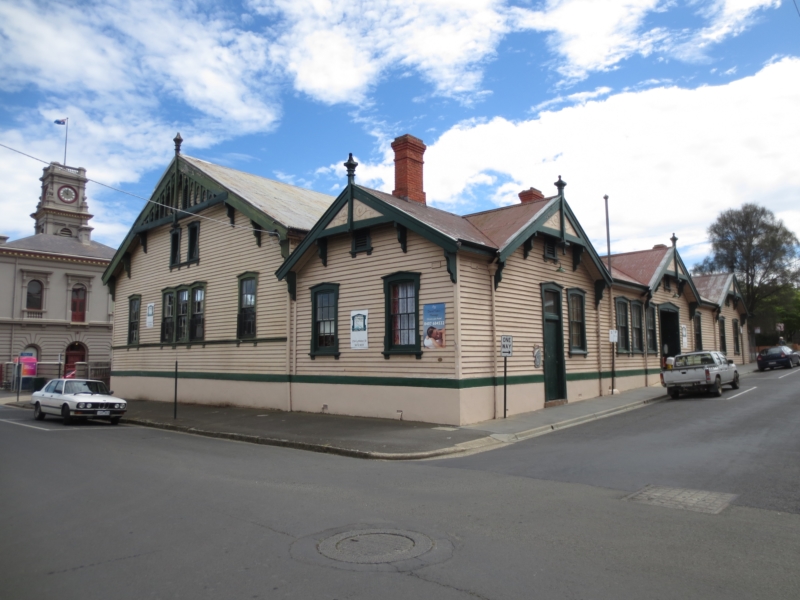
Locate an element on the screen. clock is located at coordinates (64, 196).